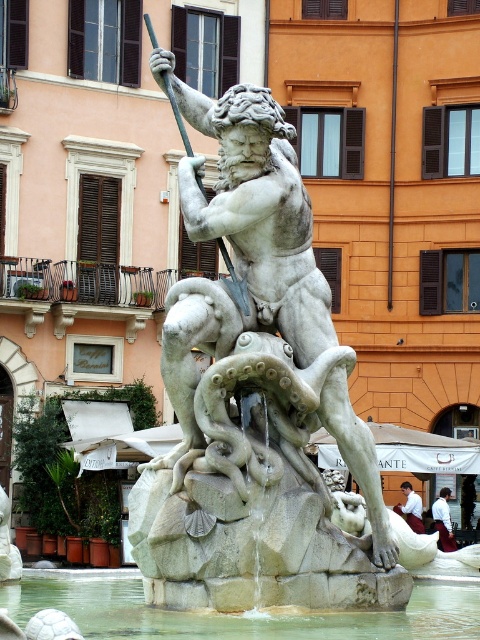
Does clear stone water at center appear on the left side of white cotton shirt at center?

Indeed, clear stone water at center is positioned on the left side of white cotton shirt at center.

Does clear stone water at center lie in front of white cotton shirt at center?

Yes.

In the scene shown: Who is more forward, (27, 580) or (421, 520)?

Point (27, 580) is in front.

Image resolution: width=480 pixels, height=640 pixels. Find the location of `clear stone water at center`. clear stone water at center is located at coordinates (238, 614).

Looking at this image, does white marble statue at center appear under white shirt at center?

No, white marble statue at center is not below white shirt at center.

Can you confirm if white marble statue at center is positioned above white shirt at center?

Yes.

Locate an element on the screen. This screenshot has height=640, width=480. white marble statue at center is located at coordinates (259, 397).

Does white shirt at center have a greater height compared to white cotton shirt at center?

Indeed, white shirt at center has a greater height compared to white cotton shirt at center.

Can you confirm if white shirt at center is thinner than white cotton shirt at center?

In fact, white shirt at center might be wider than white cotton shirt at center.

Which is in front, point (447, 532) or point (402, 490)?

Point (447, 532) is more forward.

Locate an element on the screen. Image resolution: width=480 pixels, height=640 pixels. white shirt at center is located at coordinates (444, 520).